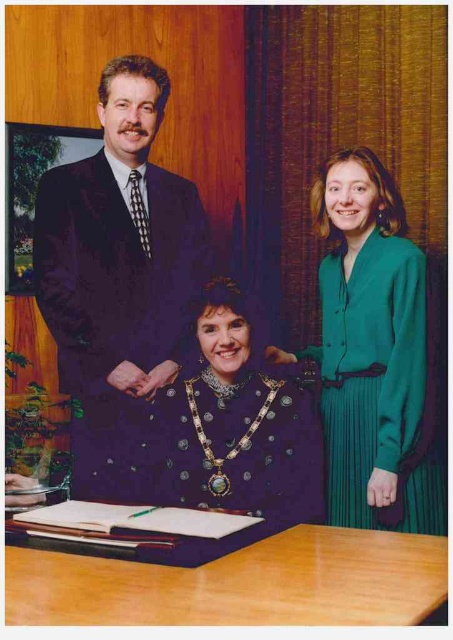
Question: Which of the following is the closest to the observer?

Choices:
 (A) (104, 362)
 (B) (123, 561)
 (C) (145, 163)
 (D) (411, 436)

Answer: (B)

Question: Is purple velvet dress at center positioned at the back of light brown wooden table at lower center?

Choices:
 (A) yes
 (B) no

Answer: (A)

Question: Which point is farther to the camera?

Choices:
 (A) green silk blouse at right
 (B) dark suit at center

Answer: (B)

Question: Does purple velvet dress at center have a smaller size compared to green silk blouse at right?

Choices:
 (A) no
 (B) yes

Answer: (B)

Question: Which of the following is the farthest from the observer?

Choices:
 (A) (x=319, y=621)
 (B) (x=364, y=522)
 (C) (x=128, y=144)

Answer: (C)

Question: Can you confirm if dark suit at center is smaller than purple velvet dress at center?

Choices:
 (A) yes
 (B) no

Answer: (B)